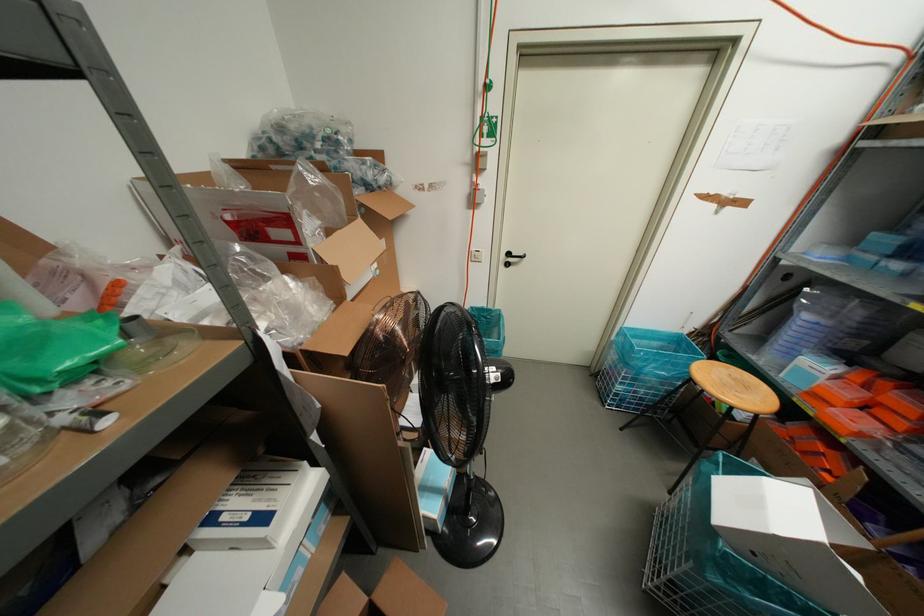
This screenshot has width=924, height=616. Identify the location of white light switch. (477, 254).